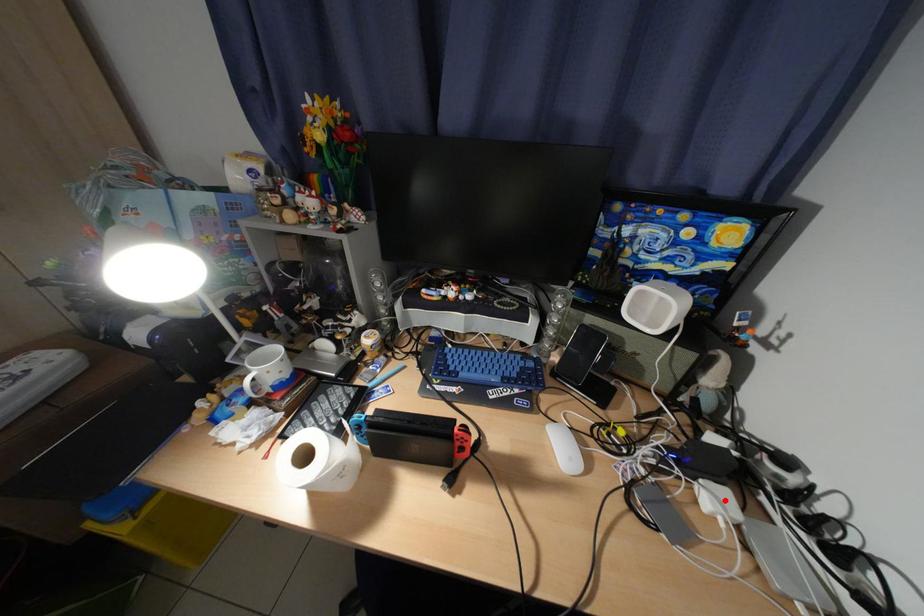
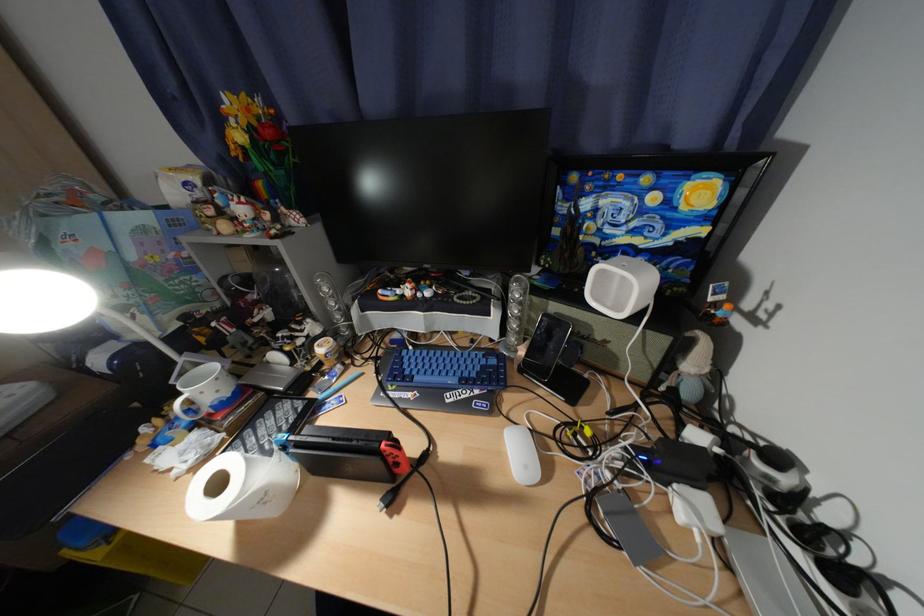
Find the pixel in the second image that matches the highlighted location in the first image.

(700, 508)